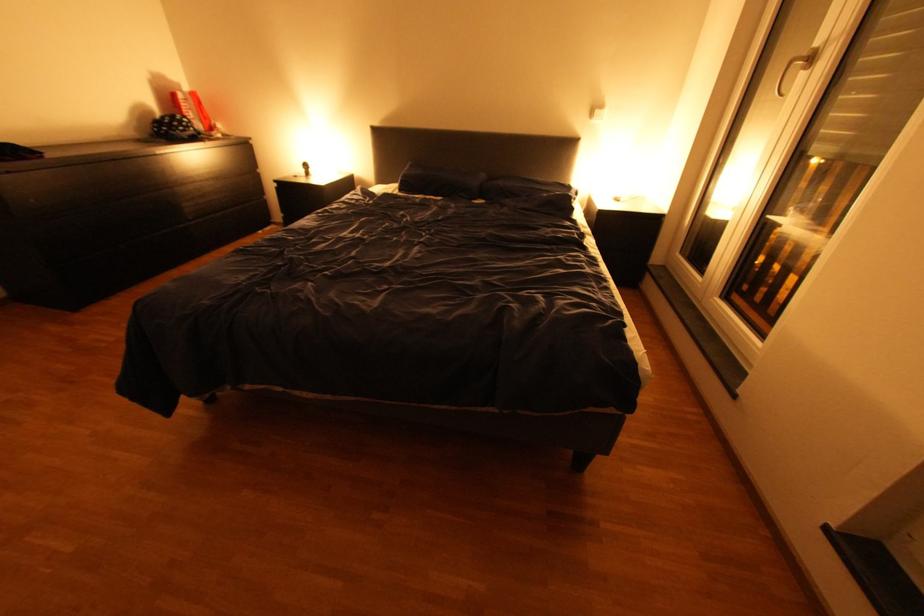
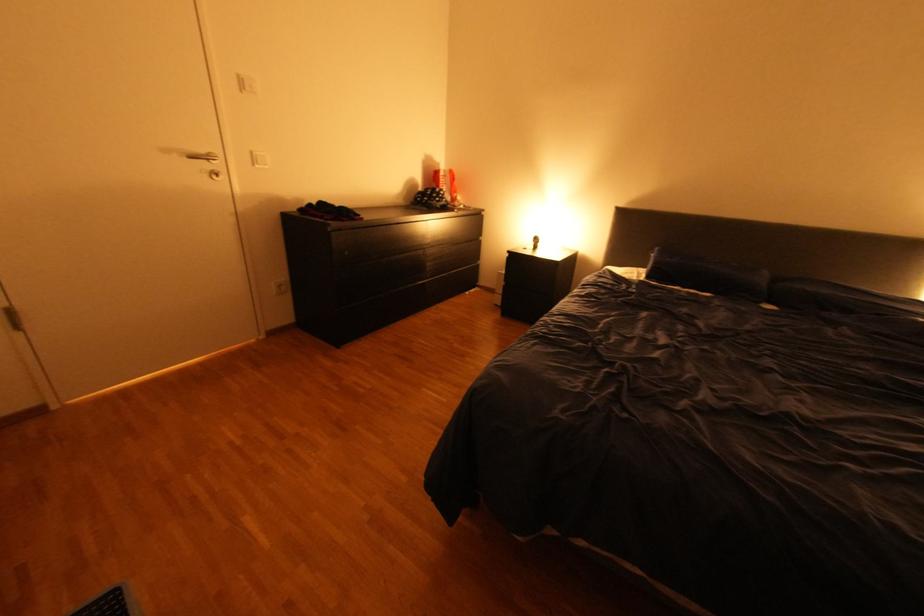
Question: The images are taken continuously from a first-person perspective. In which direction are you moving?

Choices:
 (A) Left
 (B) Right
 (C) Forward
 (D) Backward

Answer: (A)